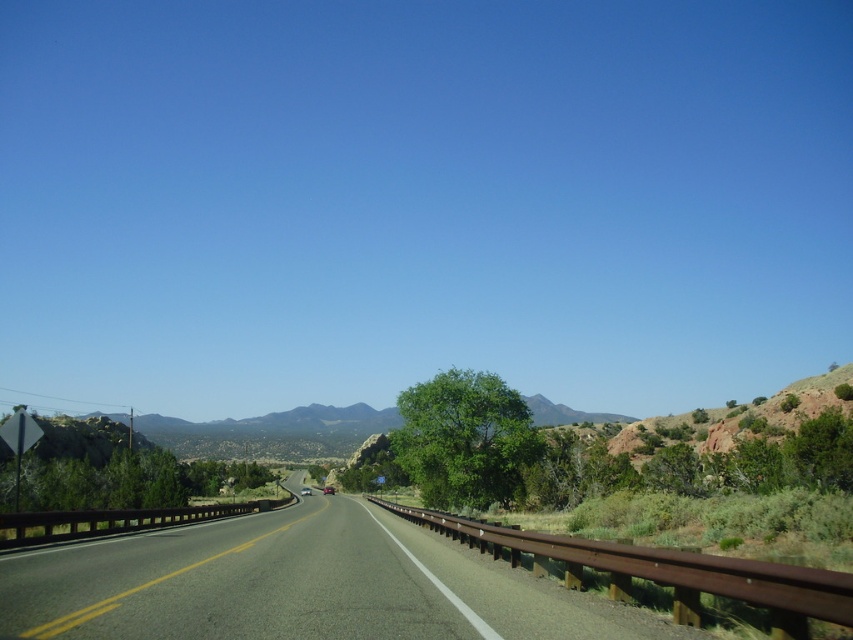
You are a pedestrian standing on the side of the road and see the asphalt road at center and the metallic silver motorcycle at center. Which object is positioned to the right from your perspective?

The asphalt road at center is to the right of the metallic silver motorcycle at center.

You are driving a car and see the image. You need to determine if your current position is on the asphalt road at center. Your GPS shows your coordinates as point (299, 586). Is your car on the asphalt road at center?

Yes, according to the coordinates, point (299, 586) corresponds to the asphalt road at center, so your car is on the asphalt road at center.